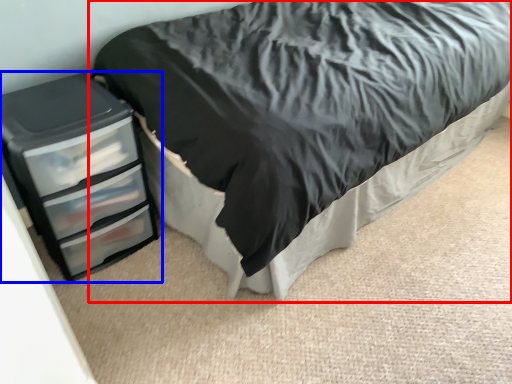
Question: Which of the following is the farthest to the observer, bed (highlighted by a red box) or chest of drawers (highlighted by a blue box)?

Choices:
 (A) bed
 (B) chest of drawers

Answer: (B)